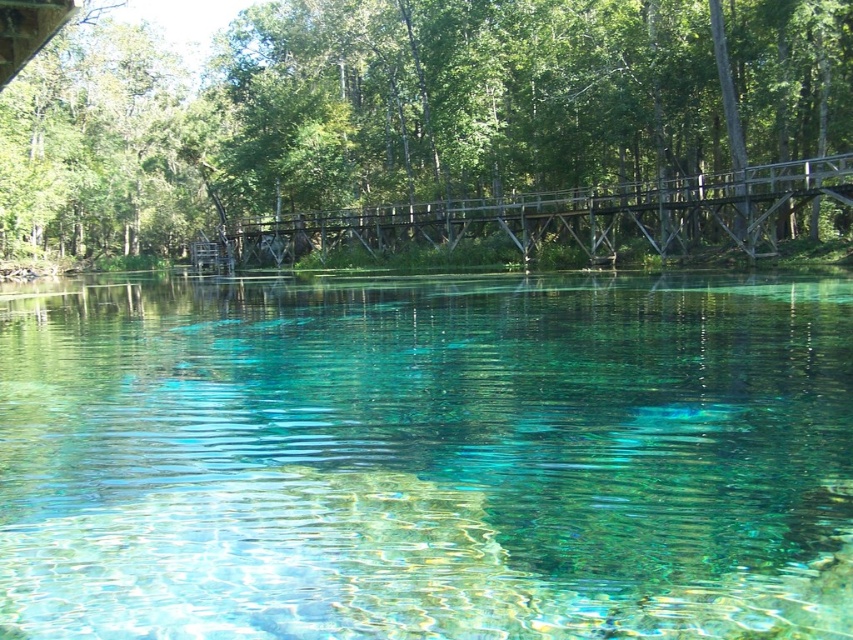
Question: Among these points, which one is farthest from the camera?

Choices:
 (A) (589, 544)
 (B) (93, 250)

Answer: (B)

Question: Which point is closer to the camera taking this photo?

Choices:
 (A) (543, 54)
 (B) (444, 448)
 (C) (749, 204)

Answer: (B)

Question: Can you confirm if clear glassy water at center is positioned to the right of wooden bridge at center?

Choices:
 (A) no
 (B) yes

Answer: (A)

Question: Which object appears farthest from the camera in this image?

Choices:
 (A) wooden bridge at center
 (B) clear glassy water at center
 (C) green matte bridge at upper center

Answer: (C)

Question: Is clear glassy water at center thinner than wooden bridge at center?

Choices:
 (A) no
 (B) yes

Answer: (B)

Question: Is clear glassy water at center smaller than green matte bridge at upper center?

Choices:
 (A) no
 (B) yes

Answer: (B)